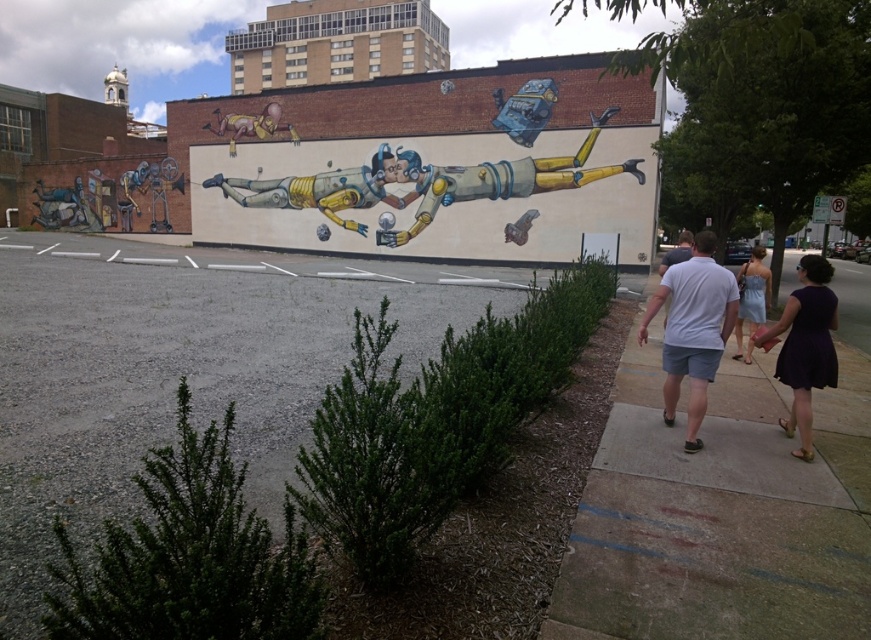
Does metallic yellow robot at center appear under metallic gold horse at upper left?

Indeed, metallic yellow robot at center is positioned under metallic gold horse at upper left.

Can you confirm if metallic yellow robot at center is thinner than metallic gold horse at upper left?

No.

Between point (404, 168) and point (279, 113), which one is positioned behind?

The point (279, 113) is behind.

Where is `metallic yellow robot at center`? Image resolution: width=871 pixels, height=640 pixels. metallic yellow robot at center is located at coordinates (490, 179).

Does concrete sidewalk at center right have a lesser height compared to white cotton shirt at center?

No, concrete sidewalk at center right is not shorter than white cotton shirt at center.

Does point (630, 412) come behind point (720, 353)?

Yes.

Image resolution: width=871 pixels, height=640 pixels. Identify the location of concrete sidewalk at center right. (721, 513).

Does metallic yellow astronaut at center have a lesser height compared to purple satin dress at lower right?

No.

Who is more forward, (402,164) or (815,326)?

Point (815,326) is in front.

Is point (402, 154) farther from viewer compared to point (829, 346)?

Yes.

You are a GUI agent. You are given a task and a screenshot of the screen. Output one action in this format:
    pyautogui.click(x=<x>, y=<y>)
    Task: Click on the metallic yellow astronaut at center
    This screenshot has height=640, width=871.
    Given the screenshot: What is the action you would take?
    pyautogui.click(x=334, y=186)